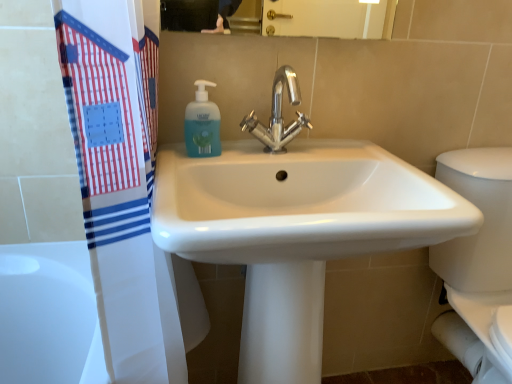
Question: Does polished chrome faucet at center have a larger size compared to white glossy sink at center?

Choices:
 (A) yes
 (B) no

Answer: (B)

Question: Can you confirm if polished chrome faucet at center is wider than white glossy sink at center?

Choices:
 (A) no
 (B) yes

Answer: (A)

Question: Could you tell me if polished chrome faucet at center is turned towards white glossy sink at center?

Choices:
 (A) no
 (B) yes

Answer: (A)

Question: From a real-world perspective, does polished chrome faucet at center sit lower than white glossy sink at center?

Choices:
 (A) no
 (B) yes

Answer: (A)

Question: From the image's perspective, is polished chrome faucet at center on top of white glossy sink at center?

Choices:
 (A) yes
 (B) no

Answer: (A)

Question: From the image's perspective, is polished chrome faucet at center positioned above or below white glossy sink at center?

Choices:
 (A) above
 (B) below

Answer: (A)

Question: In terms of height, does polished chrome faucet at center look taller or shorter compared to white glossy sink at center?

Choices:
 (A) tall
 (B) short

Answer: (B)

Question: Is polished chrome faucet at center wider or thinner than white glossy sink at center?

Choices:
 (A) wide
 (B) thin

Answer: (B)

Question: In the image, is polished chrome faucet at center positioned in front of or behind white glossy sink at center?

Choices:
 (A) front
 (B) behind

Answer: (B)

Question: Considering the positions of translucent plastic soap dispenser at upper center and polished chrome faucet at center in the image, is translucent plastic soap dispenser at upper center taller or shorter than polished chrome faucet at center?

Choices:
 (A) short
 (B) tall

Answer: (A)

Question: In the image, is translucent plastic soap dispenser at upper center positioned in front of or behind polished chrome faucet at center?

Choices:
 (A) front
 (B) behind

Answer: (B)

Question: Looking at their shapes, would you say translucent plastic soap dispenser at upper center is wider or thinner than polished chrome faucet at center?

Choices:
 (A) wide
 (B) thin

Answer: (B)

Question: In terms of size, does translucent plastic soap dispenser at upper center appear bigger or smaller than polished chrome faucet at center?

Choices:
 (A) big
 (B) small

Answer: (B)

Question: From a real-world perspective, is white glossy porcelain at right physically located above or below white glossy sink at center?

Choices:
 (A) below
 (B) above

Answer: (A)

Question: From the image's perspective, is white glossy porcelain at right located above or below white glossy sink at center?

Choices:
 (A) below
 (B) above

Answer: (B)